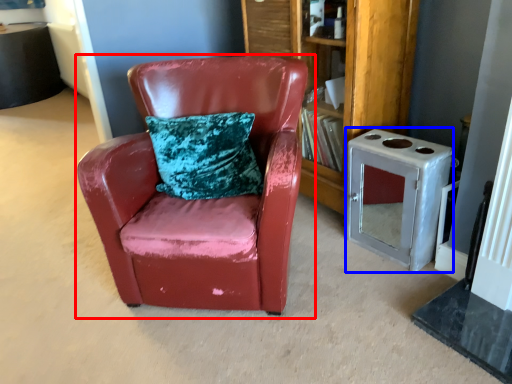
Question: Among these objects, which one is nearest to the camera, chair (highlighted by a red box) or appliance (highlighted by a blue box)?

Choices:
 (A) chair
 (B) appliance

Answer: (A)